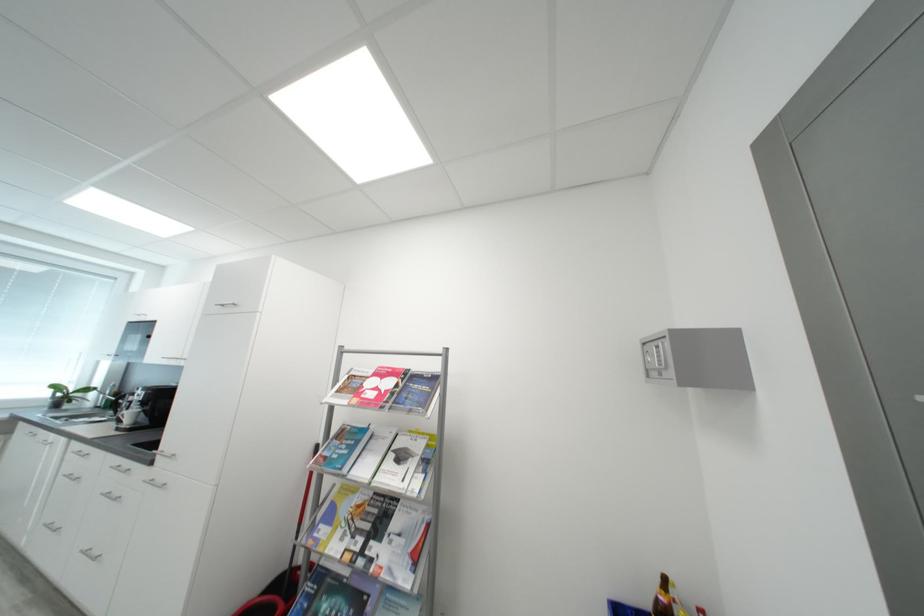
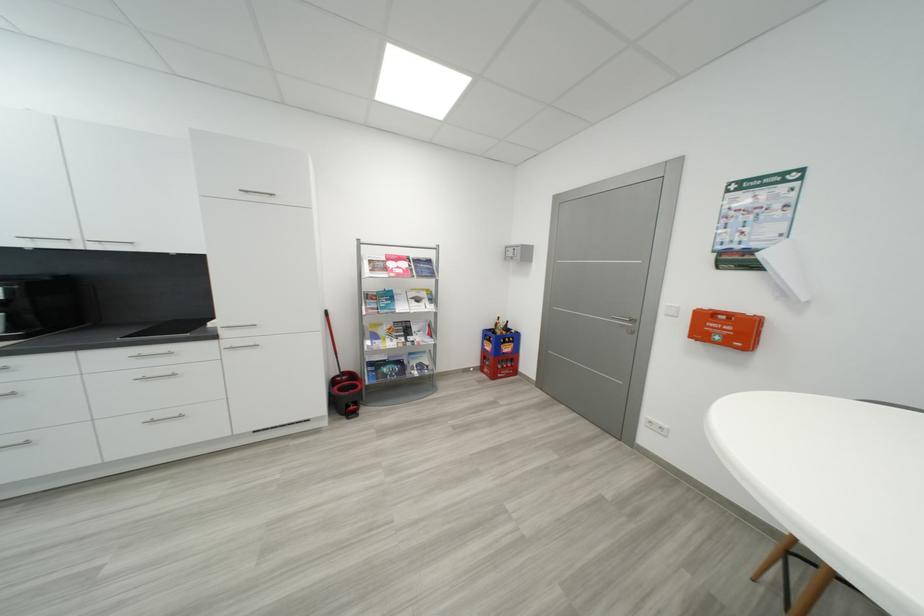
Locate, in the second image, the point that corresponds to (365,392) in the first image.

(393, 270)